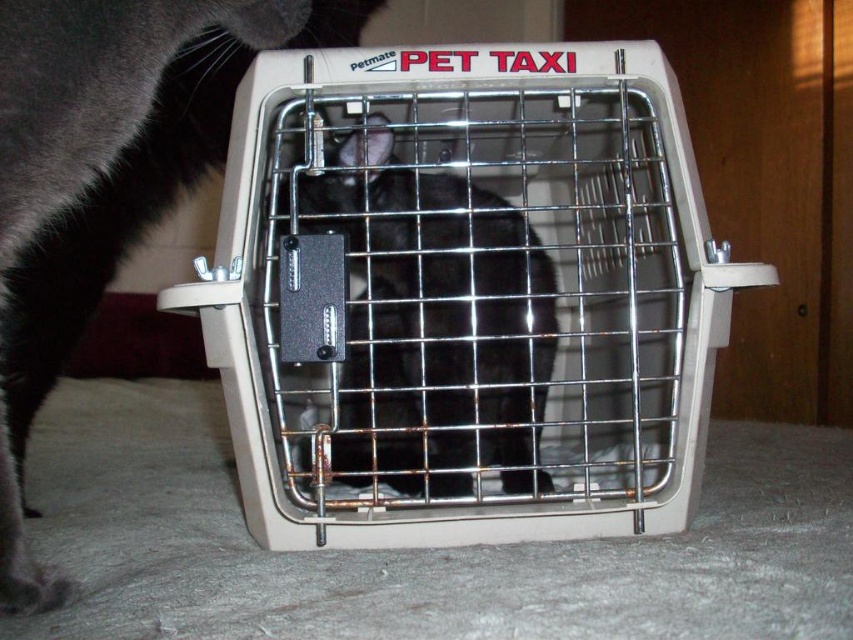
Which of these two, black fur cat at center or black matte fur cat at center, stands shorter?

With less height is black matte fur cat at center.

Does black fur cat at center lie behind black matte fur cat at center?

No, it is in front of black matte fur cat at center.

Locate an element on the screen. This screenshot has height=640, width=853. black fur cat at center is located at coordinates (105, 177).

Who is more forward, (299,461) or (96,230)?

Point (299,461)

Looking at this image, between beige plastic pet taxi at center and black fur cat at center, which one has less height?

beige plastic pet taxi at center

Does point (457, 282) come in front of point (158, 195)?

Yes, it is.

At what (x,y) coordinates should I click in order to perform the action: click on beige plastic pet taxi at center. Please return your answer as a coordinate pair (x, y). The image size is (853, 640). Looking at the image, I should click on (468, 291).

Is point (527, 168) in front of point (369, 115)?

No, (527, 168) is behind (369, 115).

Can you confirm if beige plastic pet taxi at center is positioned to the left of black matte fur cat at center?

In fact, beige plastic pet taxi at center is to the right of black matte fur cat at center.

Where is `beige plastic pet taxi at center`? beige plastic pet taxi at center is located at coordinates (468, 291).